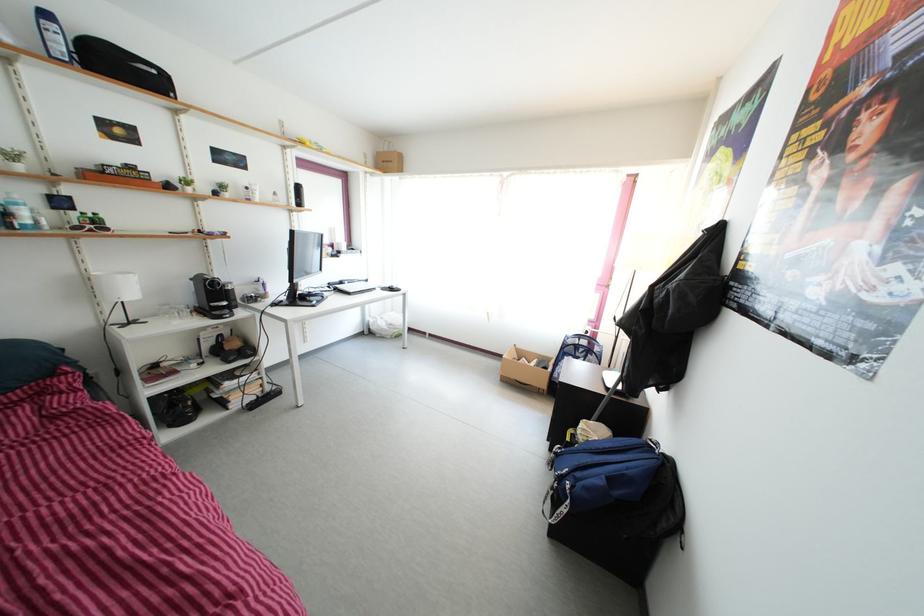
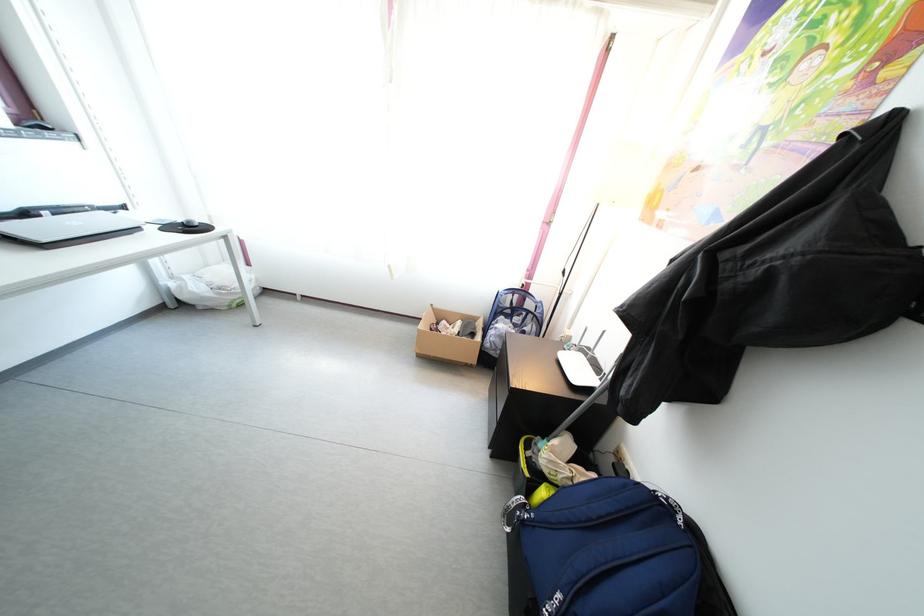
Question: Which direction would the cameraman need to move to produce the second image? Reply with the corresponding letter.

Choices:
 (A) Left
 (B) Right
 (C) Forward
 (D) Backward

Answer: (C)